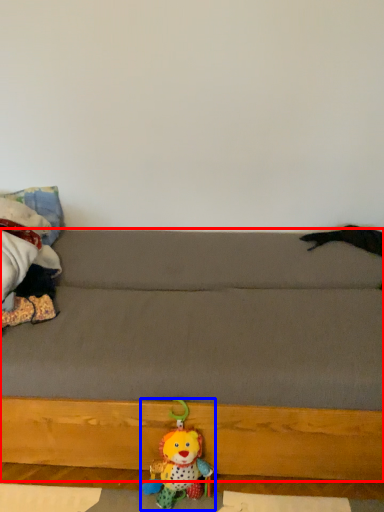
Question: Which point is closer to the camera, studio couch (highlighted by a red box) or toy (highlighted by a blue box)?

Choices:
 (A) studio couch
 (B) toy

Answer: (A)